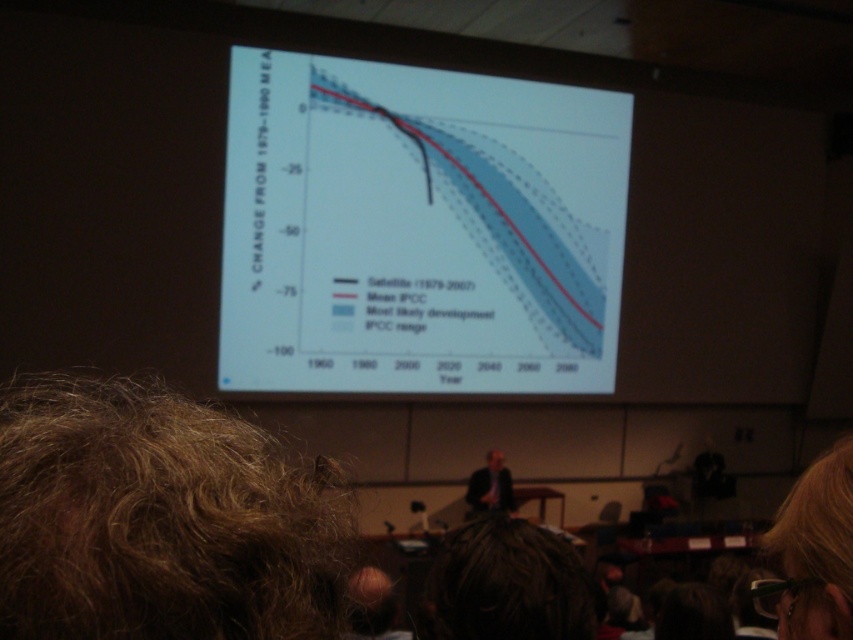
You are standing in the lecture hall and want to take a closer look at the graph on the projection screen. The point you are interested in is labeled as point (x=282, y=332). The recommended viewing distance for this screen is 20 feet to ensure clarity. Can you comfortably view the graph from your current position?

The distance between point (x=282, y=332) and the camera is 20.96 feet. Since the recommended viewing distance is 20 feet, you are slightly farther away than the recommended distance, so the graph may appear less clear from your current position.

You are an attendee at the presentation and you see the white paper at center and the brown curly hair at lower left. Which object is located higher in the image?

The white paper at center is located higher than the brown curly hair at lower left.